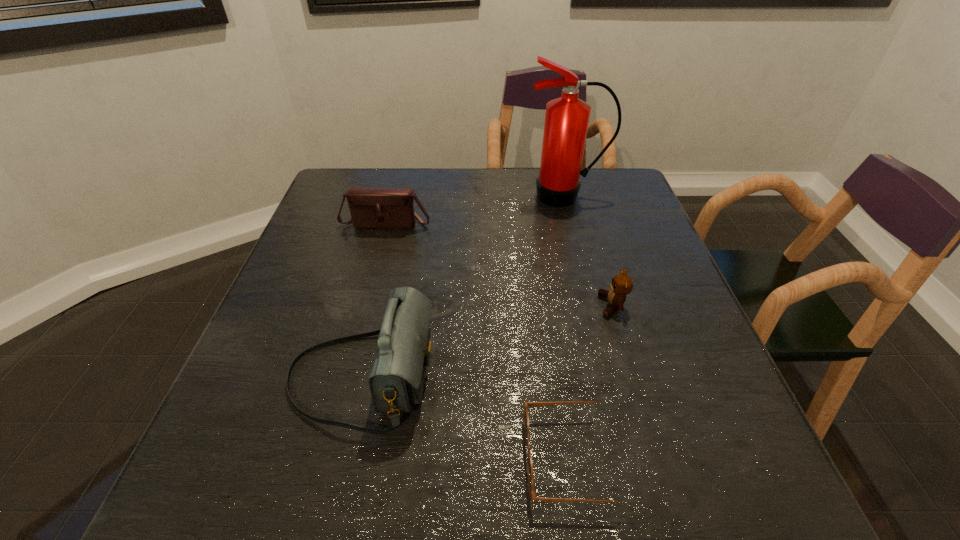
Where is `free space between the shortest object and the fourth tallest object`? free space between the shortest object and the fourth tallest object is located at coordinates (594, 382).

The width and height of the screenshot is (960, 540). What are the coordinates of `object that is the third nearest to the sunglasses` in the screenshot? It's located at (370, 207).

I want to click on object that is the third nearest to the third shortest object, so click(621, 285).

You are a GUI agent. You are given a task and a screenshot of the screen. Output one action in this format:
    pyautogui.click(x=<x>, y=<y>)
    Task: Click on the vacant region that satisfies the following two spatial constraints: 1. on the front flap of the third tallest object; 2. on the left side of the taller shoulder bag
    This screenshot has width=960, height=540.
    Given the screenshot: What is the action you would take?
    pyautogui.click(x=346, y=377)